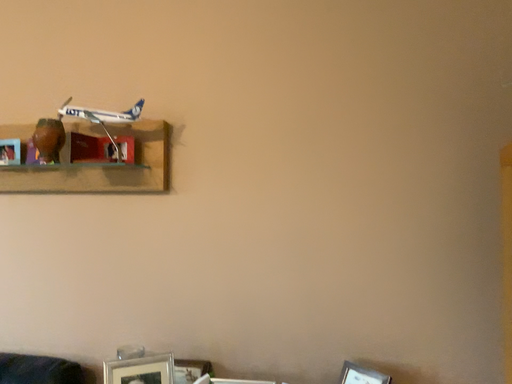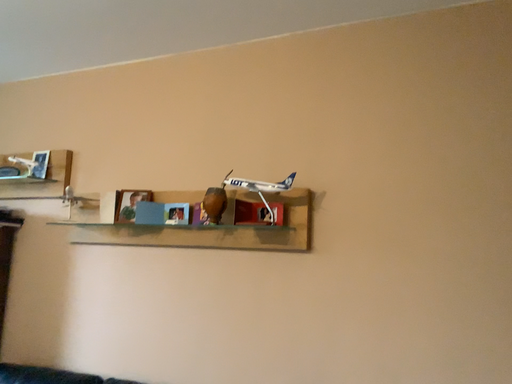
Question: Which way did the camera rotate in the video?

Choices:
 (A) rotated right
 (B) rotated left

Answer: (B)